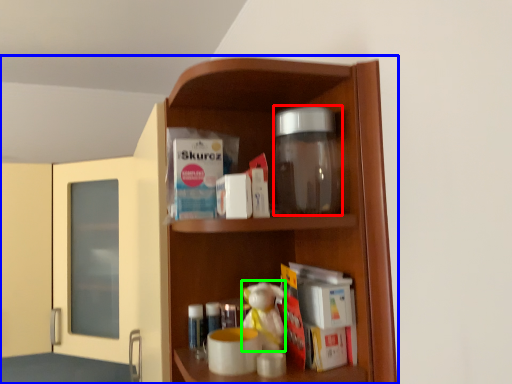
Question: Estimate the real-world distances between objects in this image. Which object is farther from glass jar (highlighted by a red box), cupboard (highlighted by a blue box) or toy (highlighted by a green box)?

Choices:
 (A) cupboard
 (B) toy

Answer: (B)